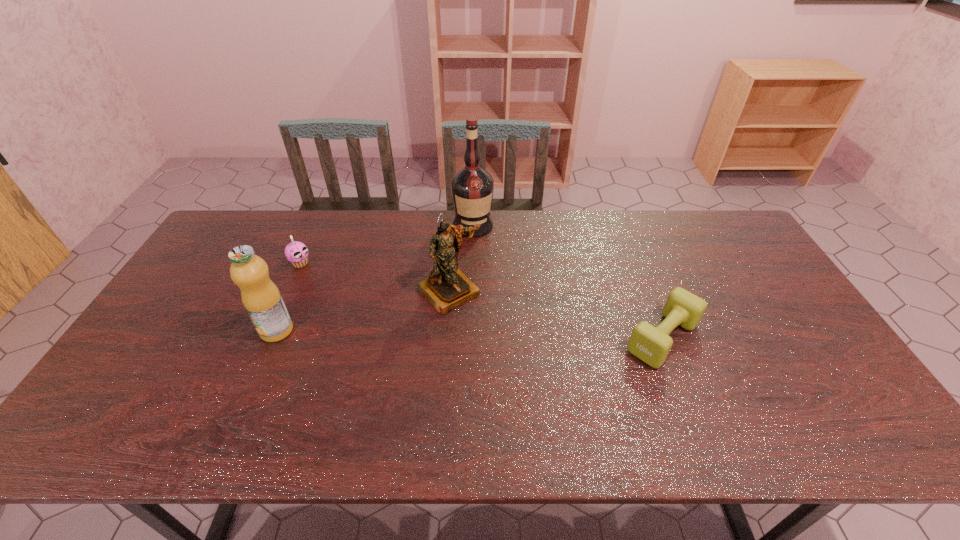
In order to click on fruit juice in this screenshot , I will do `click(261, 298)`.

The height and width of the screenshot is (540, 960). I want to click on the rightmost object, so click(650, 344).

Where is `the shortest object`? The image size is (960, 540). the shortest object is located at coordinates (650, 344).

Where is `liquor`? liquor is located at coordinates (472, 187).

Locate an element on the screen. This screenshot has height=540, width=960. the farthest object is located at coordinates (472, 187).

You are a GUI agent. You are given a task and a screenshot of the screen. Output one action in this format:
    pyautogui.click(x=<x>, y=<y>)
    Task: Click on the cupcake
    The height and width of the screenshot is (540, 960).
    Given the screenshot: What is the action you would take?
    pyautogui.click(x=296, y=252)

Locate an element on the screen. This screenshot has width=960, height=540. figurine is located at coordinates (447, 287).

Where is `free space located on the front label of the fruit juice`? The image size is (960, 540). free space located on the front label of the fruit juice is located at coordinates (262, 364).

You are a GUI agent. You are given a task and a screenshot of the screen. Output one action in this format:
    pyautogui.click(x=<x>, y=<y>)
    Task: Click on the free space located on the right of the dumbbell
    
    Given the screenshot: What is the action you would take?
    pyautogui.click(x=729, y=338)

Identify the location of blank space located 0.230m on the surface of the farthest object. The width and height of the screenshot is (960, 540). (482, 284).